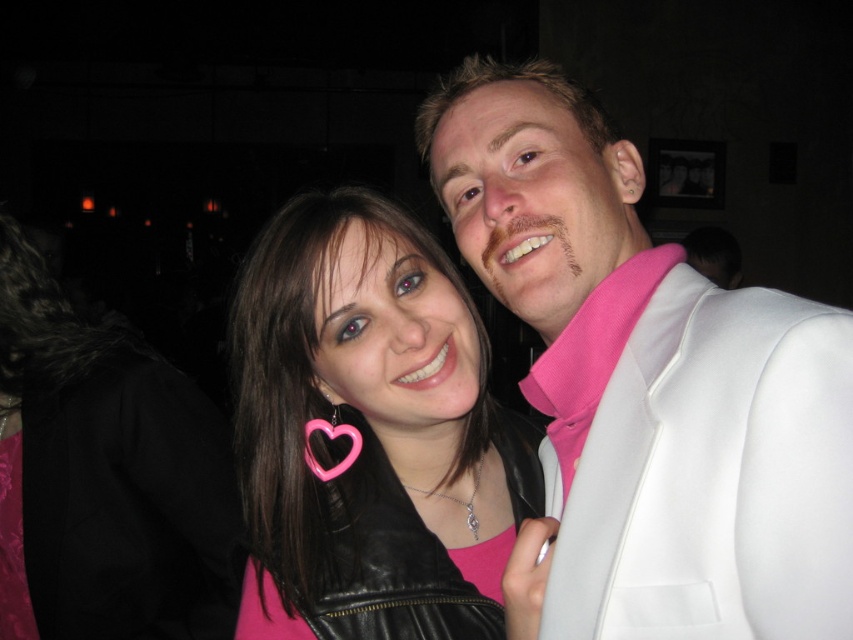
Find the location of `white satin suit at upper right`. white satin suit at upper right is located at coordinates (650, 381).

From the picture: Who is positioned more to the left, white satin suit at upper right or pink matte heart-shaped earrings at upper center?

pink matte heart-shaped earrings at upper center

Is point (846, 310) closer to viewer compared to point (115, 524)?

Yes, it is.

The height and width of the screenshot is (640, 853). Identify the location of white satin suit at upper right. (650, 381).

Can you confirm if pink matte heart-shaped earring at center is wider than pink matte heart-shaped earrings at upper center?

In fact, pink matte heart-shaped earring at center might be narrower than pink matte heart-shaped earrings at upper center.

Which of these two, pink matte heart-shaped earring at center or pink matte heart-shaped earrings at upper center, stands taller?

With more height is pink matte heart-shaped earrings at upper center.

Image resolution: width=853 pixels, height=640 pixels. I want to click on pink matte heart-shaped earring at center, so click(370, 433).

Which is behind, point (637, 531) or point (502, 556)?

The point (502, 556) is behind.

Does point (639, 429) come closer to viewer compared to point (518, 512)?

Yes, it is in front of point (518, 512).

I want to click on white satin suit at upper right, so click(650, 381).